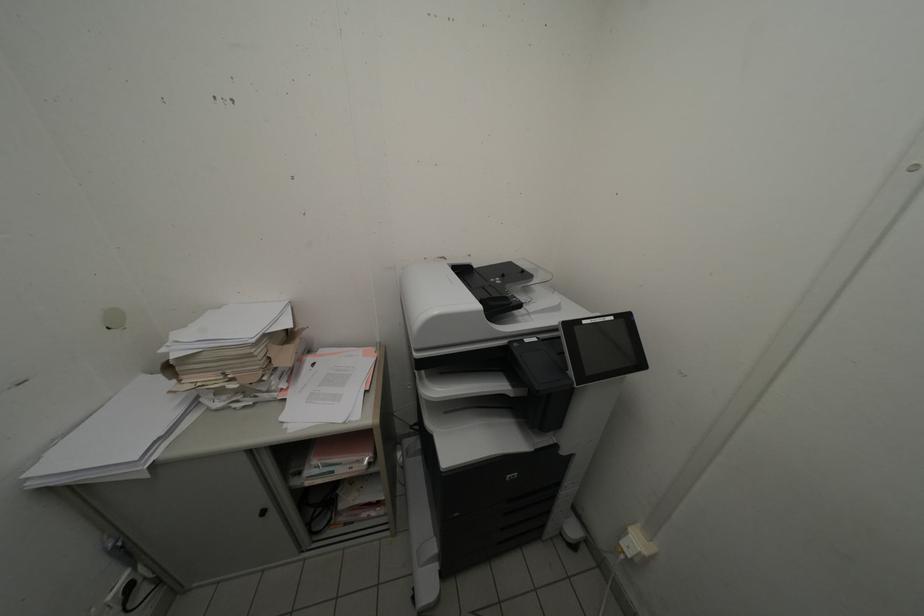
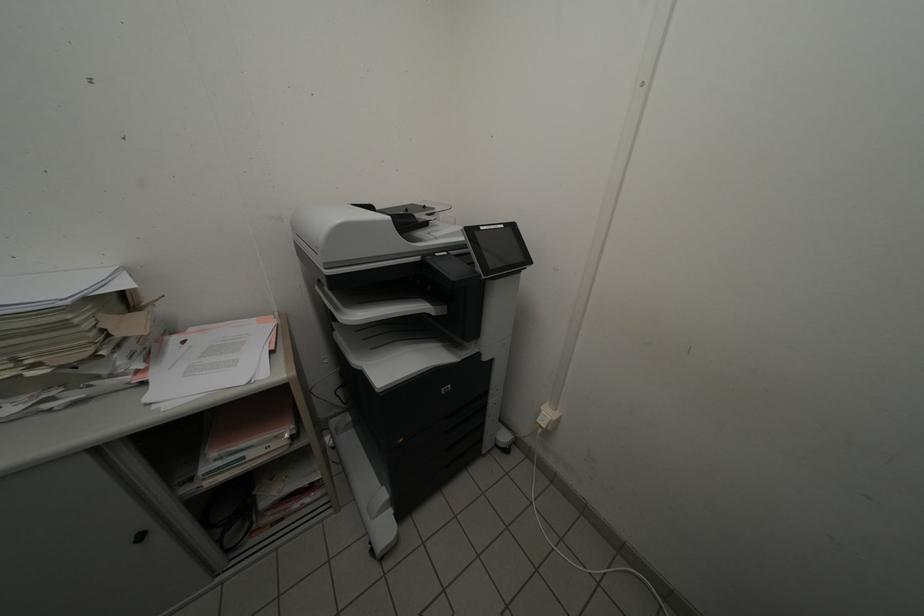
Question: Based on the continuous images, in which direction is the camera rotating? Reply with the corresponding letter.

Choices:
 (A) Left
 (B) Right
 (C) Up
 (D) Down

Answer: (B)